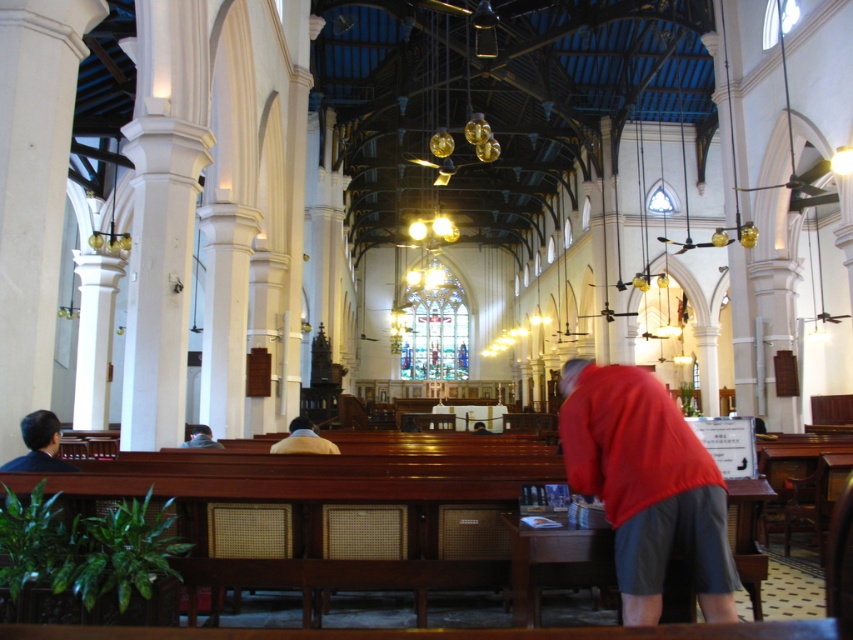
Can you confirm if red matte shirt at center is smaller than matte black hair at left?

Incorrect, red matte shirt at center is not smaller in size than matte black hair at left.

Consider the image. Does red matte shirt at center have a greater width compared to matte black hair at left?

Yes, red matte shirt at center is wider than matte black hair at left.

The image size is (853, 640). What do you see at coordinates (646, 484) in the screenshot?
I see `red matte shirt at center` at bounding box center [646, 484].

You are a GUI agent. You are given a task and a screenshot of the screen. Output one action in this format:
    pyautogui.click(x=<x>, y=<y>)
    Task: Click on the red matte shirt at center
    The width and height of the screenshot is (853, 640).
    Given the screenshot: What is the action you would take?
    pyautogui.click(x=646, y=484)

Can you confirm if red matte shirt at center is thinner than yellow fabric jacket at center?

Incorrect, red matte shirt at center's width is not less than yellow fabric jacket at center's.

Measure the distance from red matte shirt at center to yellow fabric jacket at center.

A distance of 13.52 meters exists between red matte shirt at center and yellow fabric jacket at center.

Describe the element at coordinates (646, 484) in the screenshot. I see `red matte shirt at center` at that location.

Identify the location of red matte shirt at center. (646, 484).

Which is more to the right, yellow fabric jacket at center or light brown wooden bench at lower left?

yellow fabric jacket at center

Who is more forward, (x=287, y=444) or (x=190, y=435)?

Point (x=287, y=444) is more forward.

Between point (279, 449) and point (198, 442), which one is positioned in front?

Point (279, 449)

Locate an element on the screen. The height and width of the screenshot is (640, 853). yellow fabric jacket at center is located at coordinates (303, 440).